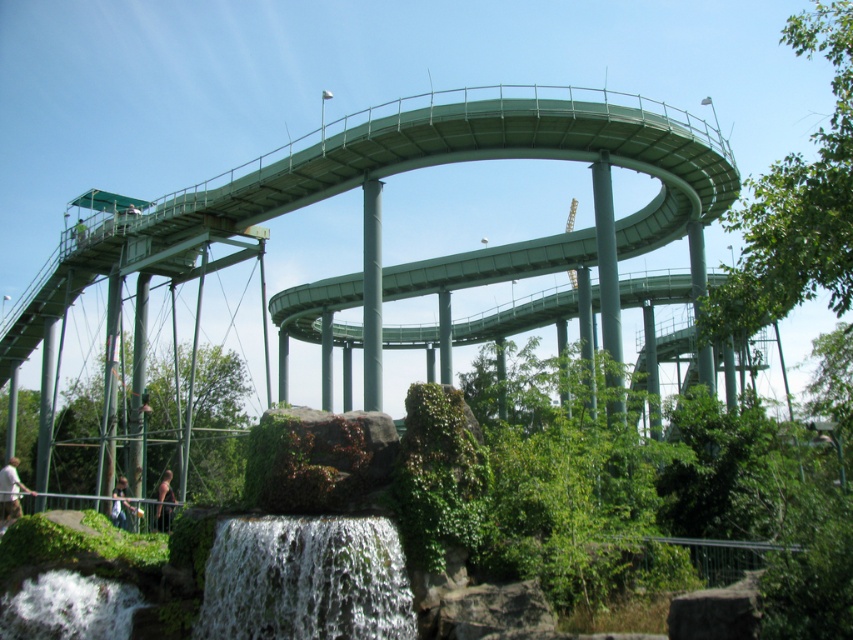
You are standing at the base of the roller coaster and see the white frothy water at lower center and the dark brown leather jacket at lower center. Which object is narrower in width?

The white frothy water at lower center is thinner than the dark brown leather jacket at lower center, so the white frothy water at lower center is narrower in width.

Based on the photo, you are standing at the base of the roller coaster and notice both the white frothy water at lower center and the dark brown leather jacket at lower center. Which object is nearer to you?

The white frothy water at lower center is closer to the viewer than the dark brown leather jacket at lower center, so the white frothy water is nearer.

In the scene shown: Please look at the image. There is a white fabric shirt at lower left. Where exactly is it located? Provide the coordinates in the format of point followed by the coordinate numbers.

The white fabric shirt at lower left is located at point [10,492].